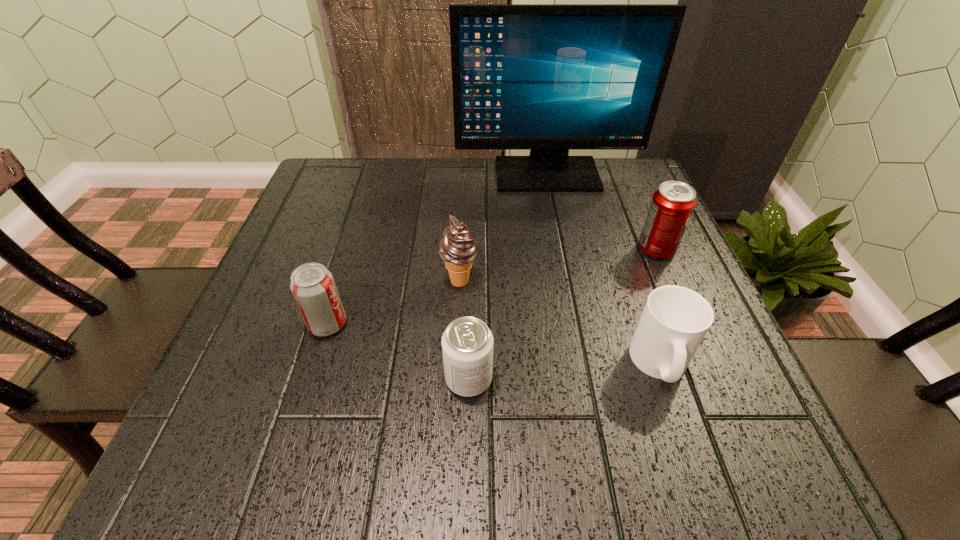
This screenshot has width=960, height=540. In order to click on the farthest object in this screenshot , I will do `click(548, 78)`.

Find the location of a particular element. This screenshot has height=540, width=960. the tallest object is located at coordinates (548, 78).

I want to click on icecream, so click(x=458, y=249).

The image size is (960, 540). What are the coordinates of `the rightmost soda can` in the screenshot? It's located at (672, 204).

This screenshot has height=540, width=960. I want to click on the tallest soda can, so click(672, 204).

Find the location of a particular element. This screenshot has width=960, height=540. the second nearest soda can is located at coordinates (312, 285).

Locate an element on the screen. the leftmost object is located at coordinates (312, 285).

At what (x,y) coordinates should I click in order to perform the action: click on mug. Please return your answer as a coordinate pair (x, y). Looking at the image, I should click on (675, 320).

The width and height of the screenshot is (960, 540). Find the location of `the second soda can from left to right`. the second soda can from left to right is located at coordinates (467, 343).

Find the location of `free space located 0.400m on the screen side of the farthest object`. free space located 0.400m on the screen side of the farthest object is located at coordinates (574, 311).